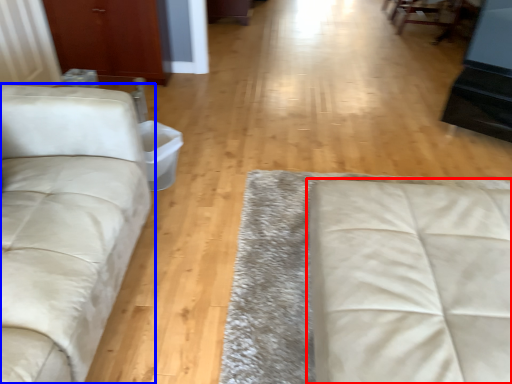
Question: Which point is further to the camera, studio couch (highlighted by a red box) or studio couch (highlighted by a blue box)?

Choices:
 (A) studio couch
 (B) studio couch

Answer: (A)